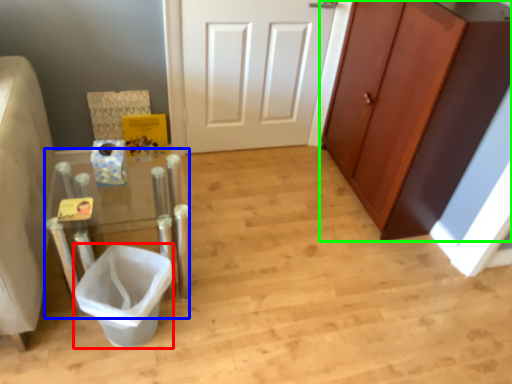
Question: Considering the real-world distances, which object is farthest from toilet bowl (highlighted by a red box)? vanity (highlighted by a blue box) or cabinetry (highlighted by a green box)?

Choices:
 (A) vanity
 (B) cabinetry

Answer: (B)